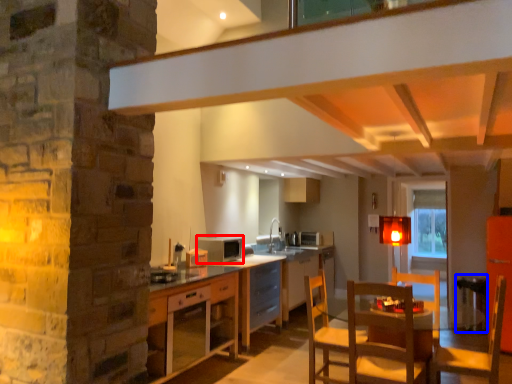
Question: Which object appears closest to the camera in this image, appliance (highlighted by a red box) or bar stool (highlighted by a blue box)?

Choices:
 (A) appliance
 (B) bar stool

Answer: (A)